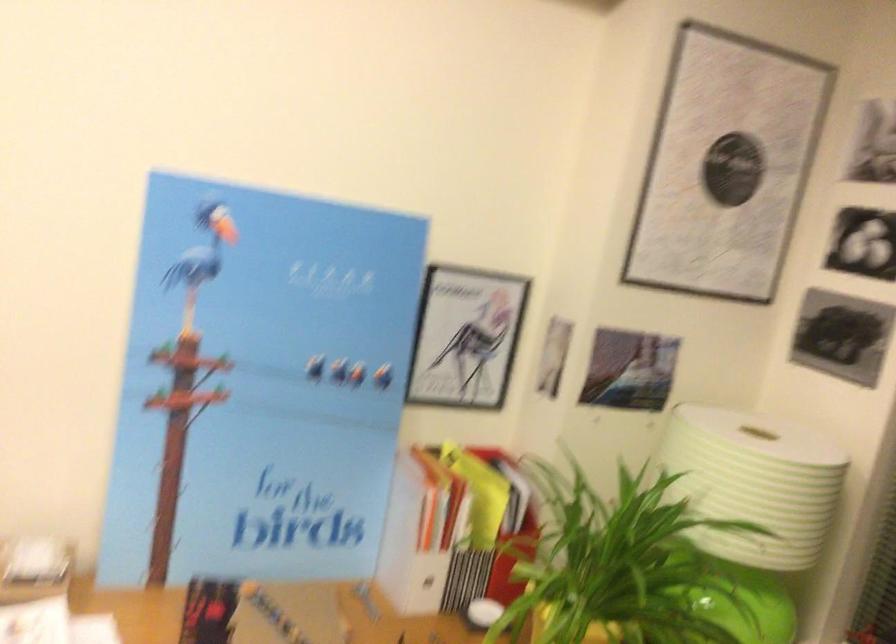
The location [507,536] corresponds to which object?

This point indicates the red file holder.